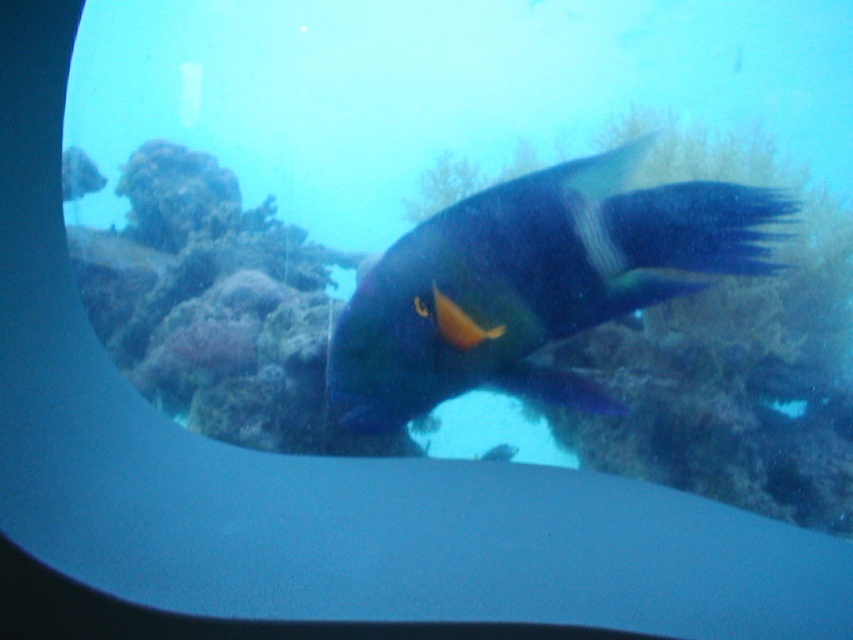
Question: Is purple coral at center positioned in front of shiny blue fish at center?

Choices:
 (A) no
 (B) yes

Answer: (A)

Question: Which of the following is the closest to the observer?

Choices:
 (A) (811, 257)
 (B) (572, 250)

Answer: (B)

Question: Does purple coral at center lie in front of shiny blue fish at center?

Choices:
 (A) yes
 (B) no

Answer: (B)

Question: Which object appears closest to the camera in this image?

Choices:
 (A) shiny blue fish at center
 (B) purple coral at center

Answer: (A)

Question: Is purple coral at center above shiny blue fish at center?

Choices:
 (A) yes
 (B) no

Answer: (B)